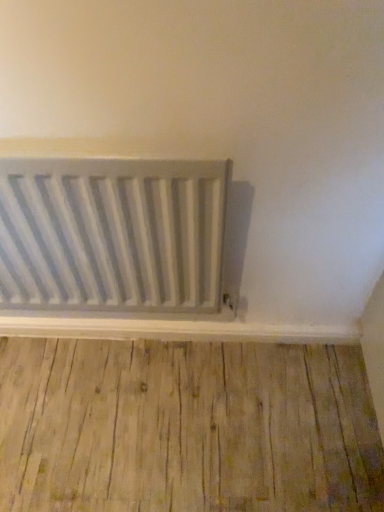
The image size is (384, 512). Find the location of `free spot above light brown wood flooring at lower center (from a real-world perspective)`. free spot above light brown wood flooring at lower center (from a real-world perspective) is located at coordinates (170, 417).